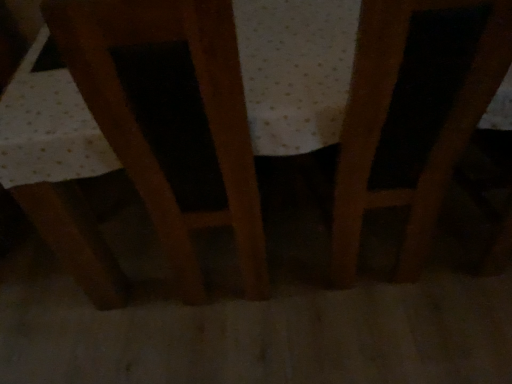
This screenshot has height=384, width=512. I want to click on free region on the left part of wooden swivel chair at center, so click(x=129, y=285).